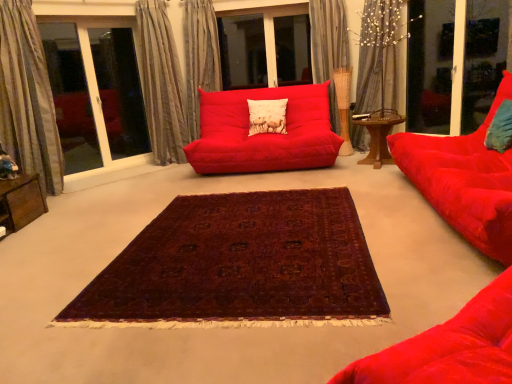
Question: Looking at their shapes, would you say wooden table at center, which is the 1th table from top to bottom, is wider or thinner than deep burgundy woven rug at center?

Choices:
 (A) thin
 (B) wide

Answer: (A)

Question: From a real-world perspective, is wooden table at center, which is counted as the first table, starting from the back, above or below deep burgundy woven rug at center?

Choices:
 (A) below
 (B) above

Answer: (B)

Question: Based on their relative distances, which object is farther from the silky beige curtain at upper center, which ranks as the 3th curtain in right-to-left order?

Choices:
 (A) deep burgundy woven rug at center
 (B) silky gray curtain at upper left, placed as the fourth curtain when sorted from right to left
 (C) green textured pillow at right, arranged as the first pillow when viewed from the front
 (D) silky gray curtain at upper center, which is the 1th curtain from right to left
 (E) wooden table at center, the first table when ordered from right to left

Answer: (C)

Question: Which object is the farthest from the matte white cushion at center, acting as the second pillow starting from the front?

Choices:
 (A) velvet red studio couch at right, which ranks as the second studio couch in left-to-right order
 (B) transparent glass screen door at upper right
 (C) silky gray curtain at upper left, placed as the fourth curtain when sorted from right to left
 (D) green textured pillow at right, arranged as the first pillow when viewed from the front
 (E) deep burgundy woven rug at center

Answer: (E)